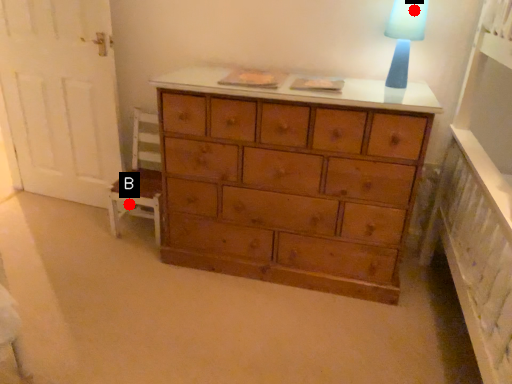
Question: Two points are circled on the image, labeled by A and B beside each circle. Which point is farther from the camera taking this photo?

Choices:
 (A) A is further
 (B) B is further

Answer: (B)